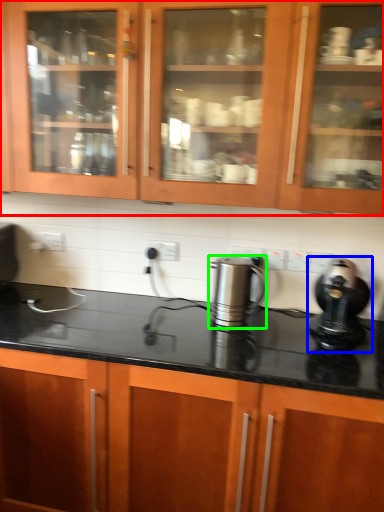
Question: Based on their relative distances, which object is nearer to cabinetry (highlighted by a red box)? Choose from home appliance (highlighted by a blue box) and kitchen appliance (highlighted by a green box).

Choices:
 (A) home appliance
 (B) kitchen appliance

Answer: (B)